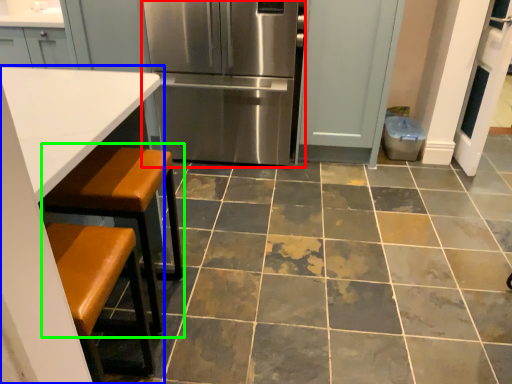
Question: Which object is positioned closest to refrigerator (highlighted by a red box)? Select from table (highlighted by a blue box) and step stool (highlighted by a green box).

Choices:
 (A) table
 (B) step stool

Answer: (B)